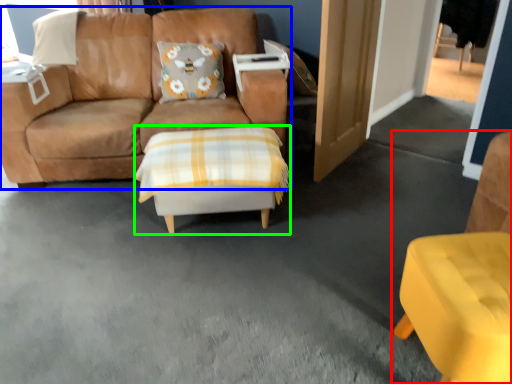
Question: Which object is positioned closest to chair (highlighted by a red box)? Select from studio couch (highlighted by a blue box) and table (highlighted by a green box).

Choices:
 (A) studio couch
 (B) table

Answer: (B)